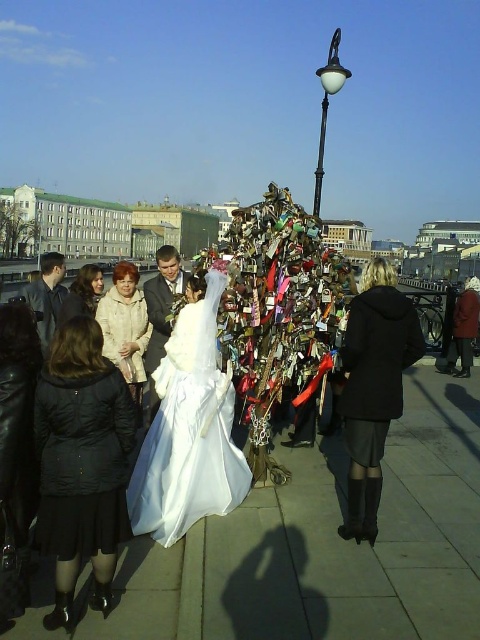
You are a photographer standing at the bridge with the tree of padlocks. You see the black matte coat at center and the matte black coat at center. Can you fit both subjects into a single photo without moving either of them?

The distance between the black matte coat at center and the matte black coat at center is 32.96 meters, which is quite large. Depending on the camera lens, it might be challenging to capture both in one frame without moving them. A wide angle lens could help, but the subjects might appear too small.

You are a photographer positioned at the point closest to the camera. You want to capture a photo that includes both the point at (165, 248) and the point at (80, 275). Which point should you focus on first to ensure both are in the frame?

You should focus on the point at (80, 275) first because it is closer to the camera. Since point at (165, 248) is behind it, adjusting the focus from the closer point will help ensure both are in the frame.